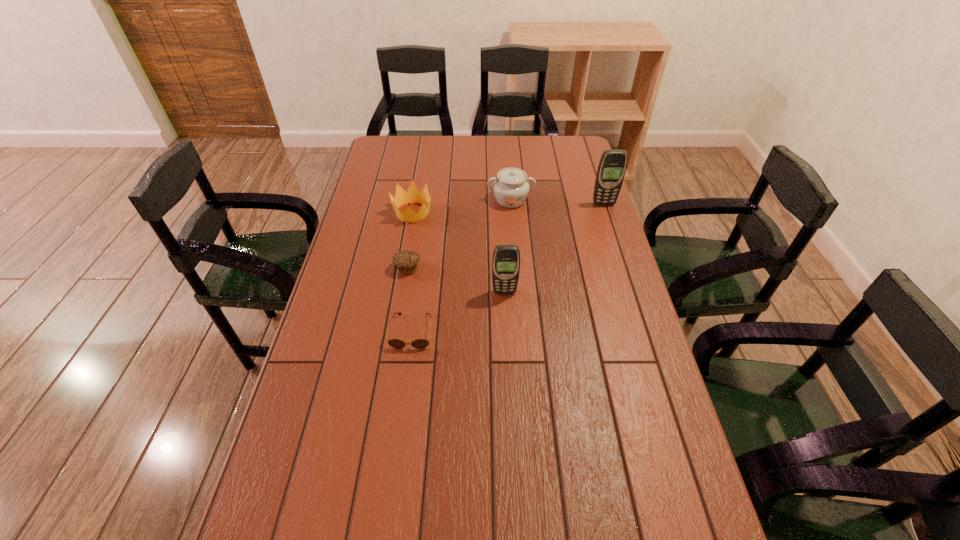
Identify the location of the left cellular telephone. (506, 258).

Locate an element on the screen. the fifth shortest object is located at coordinates (506, 258).

What are the coordinates of `the right cellular telephone` in the screenshot? It's located at (612, 166).

Where is `the tallest object`? The height and width of the screenshot is (540, 960). the tallest object is located at coordinates (612, 166).

You are a GUI agent. You are given a task and a screenshot of the screen. Output one action in this format:
    pyautogui.click(x=<x>, y=<y>)
    Task: Click on the crown
    The height and width of the screenshot is (540, 960).
    Given the screenshot: What is the action you would take?
    tap(413, 195)

Locate an element on the screen. Image resolution: width=960 pixels, height=540 pixels. the shortest object is located at coordinates (395, 343).

Identify the location of the nearest object. This screenshot has width=960, height=540. tap(395, 343).

At what (x,y) coordinates should I click in order to perform the action: click on the third nearest object. Please return your answer as a coordinate pair (x, y). Looking at the image, I should click on (406, 261).

The height and width of the screenshot is (540, 960). Find the location of `the second shortest object`. the second shortest object is located at coordinates (406, 261).

I want to click on the fourth shortest object, so click(511, 187).